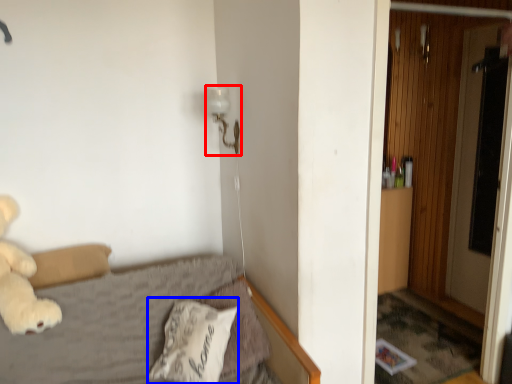
Question: Which point is further to the camera, lamp (highlighted by a red box) or pillow (highlighted by a blue box)?

Choices:
 (A) lamp
 (B) pillow

Answer: (A)